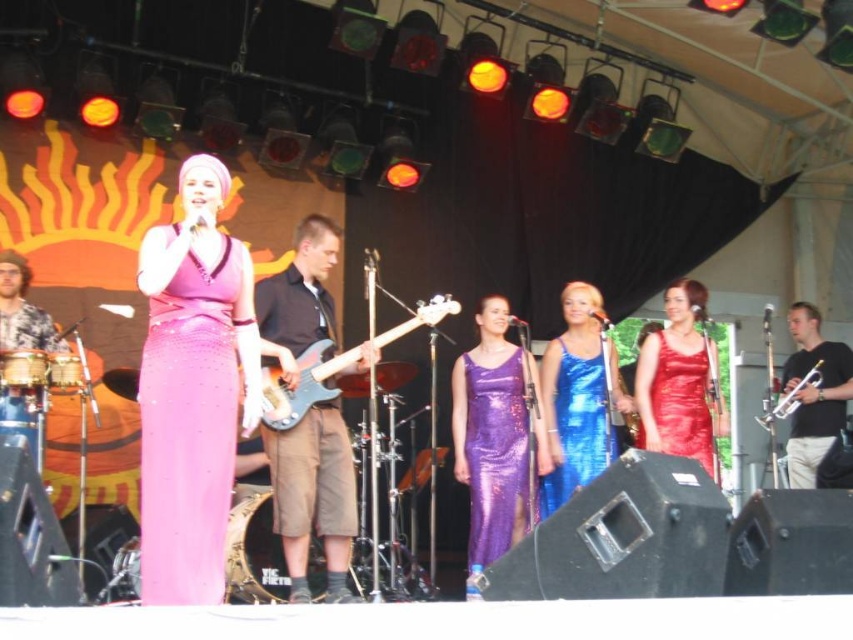
Which of these two, satin shiny dress at left or satin blue electric guitar at center, stands taller?

With more height is satin shiny dress at left.

Is satin shiny dress at left positioned at the back of satin blue electric guitar at center?

No, it is in front of satin blue electric guitar at center.

Locate an element on the screen. The image size is (853, 640). satin shiny dress at left is located at coordinates (189, 428).

Locate an element on the screen. The image size is (853, 640). satin shiny dress at left is located at coordinates (189, 428).

Is shiny purple dress at center smaller than shiny blue dress at center?

Actually, shiny purple dress at center might be larger than shiny blue dress at center.

Which is more to the left, shiny purple dress at center or shiny blue dress at center?

From the viewer's perspective, shiny purple dress at center appears more on the left side.

Is point (485, 406) behind point (570, 390)?

Yes, it is.

Locate an element on the screen. The image size is (853, 640). shiny purple dress at center is located at coordinates (494, 456).

How far apart are shiny purple dress at center and satin blue electric guitar at center?

The distance of shiny purple dress at center from satin blue electric guitar at center is 3.31 feet.

Which is behind, point (476, 392) or point (306, 384)?

Positioned behind is point (476, 392).

What are the coordinates of `shiny purple dress at center` in the screenshot? It's located at (494, 456).